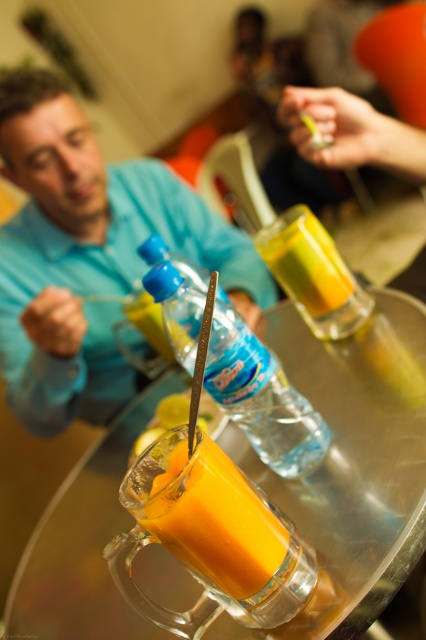
Question: Does translucent glass mug at center appear over translucent plastic juice at center?

Choices:
 (A) yes
 (B) no

Answer: (B)

Question: Which point is closer to the camera taking this photo?

Choices:
 (A) (227, 540)
 (B) (32, 636)
 (C) (29, 157)
 (D) (267, 358)

Answer: (A)

Question: Estimate the real-world distances between objects in this image. Which object is farther from the transparent glass table at center?

Choices:
 (A) blue matte shirt at upper left
 (B) translucent glass mug at center

Answer: (A)

Question: Is blue matte shirt at upper left to the right of translucent glass mug at center from the viewer's perspective?

Choices:
 (A) yes
 (B) no

Answer: (B)

Question: Which point appears closest to the camera in this image?

Choices:
 (A) (299, 346)
 (B) (215, 582)

Answer: (B)

Question: Can you confirm if transparent plastic bottle at center is positioned to the right of translucent plastic juice at center?

Choices:
 (A) no
 (B) yes

Answer: (A)